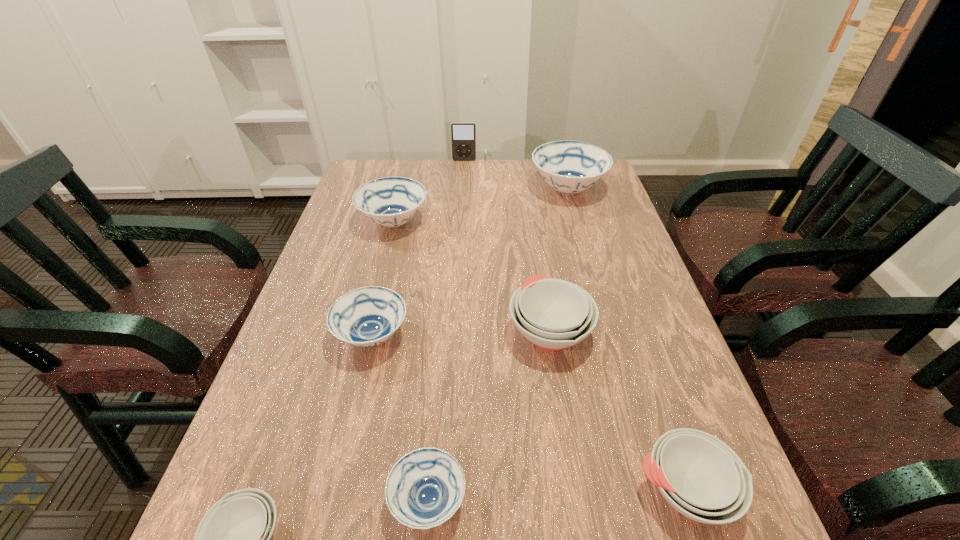
Find the location of a particular element. The image size is (960, 540). object that can be found as the seventh closest to the third smallest blue soup bowl is located at coordinates (700, 476).

This screenshot has height=540, width=960. I want to click on the closest object to the third smallest blue soup bowl, so click(x=367, y=316).

Find the location of a particular element. soup bowl that is the fourth nearest to the nearest blue soup bowl is located at coordinates [700, 476].

The height and width of the screenshot is (540, 960). Identify the location of soup bowl that is the sixth closest to the third blue soup bowl from left to right. (570, 167).

Identify the location of blue soup bowl that can be found as the third closest to the second smallest blue soup bowl. (570, 167).

Select which blue soup bowl is the third closest to the tallest soup bowl. Please provide its 2D coordinates. Your answer should be formatted as a tuple, i.e. [(x, y)], where the tuple contains the x and y coordinates of a point satisfying the conditions above.

[(424, 489)]

You are a GUI agent. You are given a task and a screenshot of the screen. Output one action in this format:
    pyautogui.click(x=<x>, y=<y>)
    Task: Click on the second closest white soup bowl to the rightmost white soup bowl
    The image size is (960, 540).
    Given the screenshot: What is the action you would take?
    pyautogui.click(x=233, y=539)

Choose which white soup bowl is the second nearest neighbor to the tallest object. Please provide its 2D coordinates. Your answer should be formatted as a tuple, i.e. [(x, y)], where the tuple contains the x and y coordinates of a point satisfying the conditions above.

[(700, 476)]

Find the location of a particular element. The height and width of the screenshot is (540, 960). free space in the image that satisfies the following two spatial constraints: 1. on the front-facing side of the tallest soup bowl; 2. on the left side of the iPod is located at coordinates (463, 190).

Locate an element on the screen. The image size is (960, 540). free space that satisfies the following two spatial constraints: 1. on the front-facing side of the rightmost white soup bowl; 2. on the right side of the tallest object is located at coordinates (445, 490).